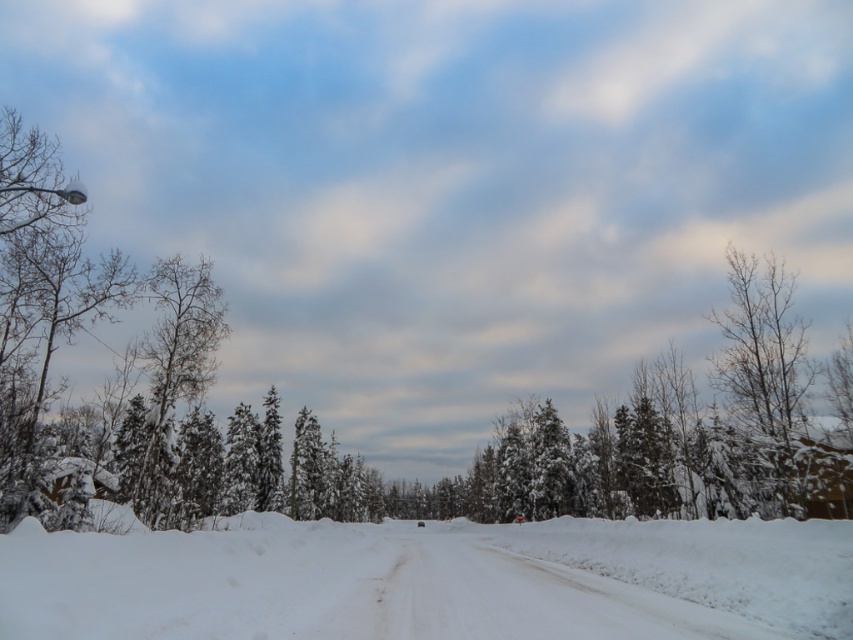
Question: Considering the relative positions of white fluffy snow at center and bare branches at right in the image provided, where is white fluffy snow at center located with respect to bare branches at right?

Choices:
 (A) right
 (B) left

Answer: (B)

Question: Which point is closer to the camera?

Choices:
 (A) (717, 364)
 (B) (415, 588)

Answer: (B)

Question: Can you confirm if white fluffy snow at center is positioned to the right of bare branches at right?

Choices:
 (A) no
 (B) yes

Answer: (A)

Question: Is white fluffy snow at center above bare branches at right?

Choices:
 (A) yes
 (B) no

Answer: (B)